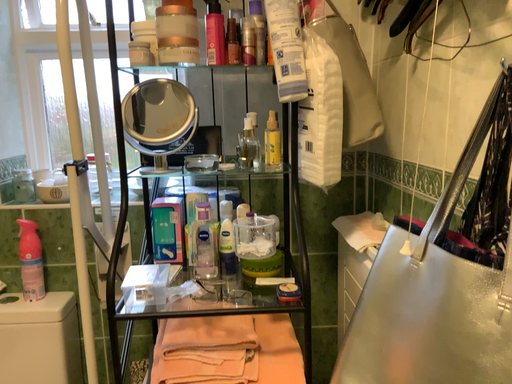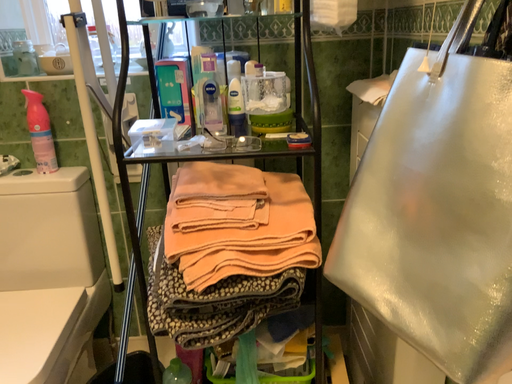
Question: Which way did the camera rotate in the video?

Choices:
 (A) rotated downward
 (B) rotated upward

Answer: (A)